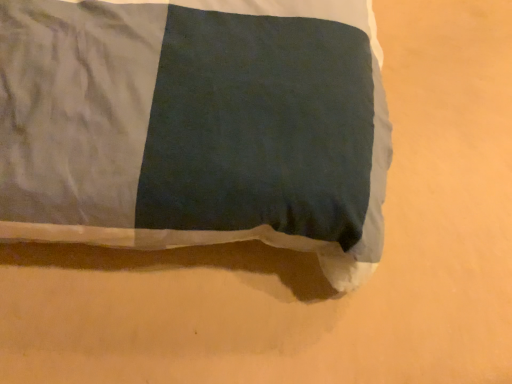
At what (x,y) coordinates should I click in order to perform the action: click on matte fabric pillow at center. Please return your answer as a coordinate pair (x, y). This screenshot has width=512, height=384. Looking at the image, I should click on (195, 126).

Describe the element at coordinates (195, 126) in the screenshot. The image size is (512, 384). I see `matte fabric pillow at center` at that location.

This screenshot has height=384, width=512. What are the coordinates of `matte fabric pillow at center` in the screenshot? It's located at click(x=195, y=126).